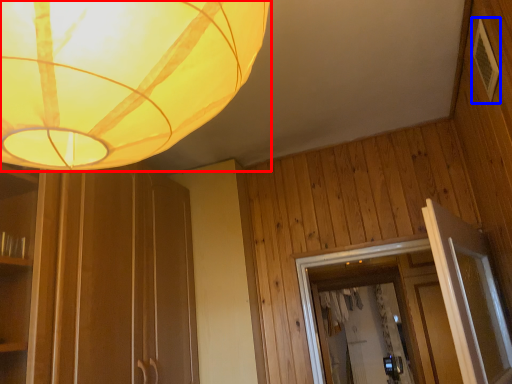
Question: Which of the following is the closest to the observer, lamp (highlighted by a red box) or panel (highlighted by a blue box)?

Choices:
 (A) lamp
 (B) panel

Answer: (A)